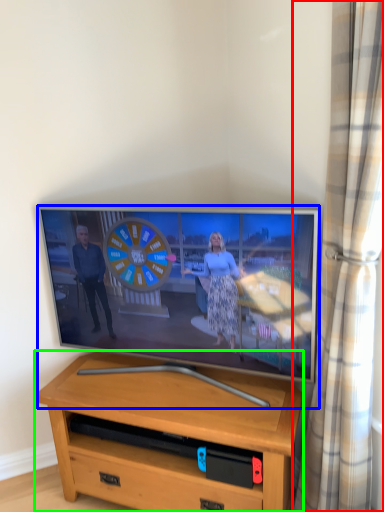
Question: Which object is positioned closest to curtain (highlighted by a red box)? Select from television (highlighted by a blue box) and desk (highlighted by a green box).

Choices:
 (A) television
 (B) desk

Answer: (A)